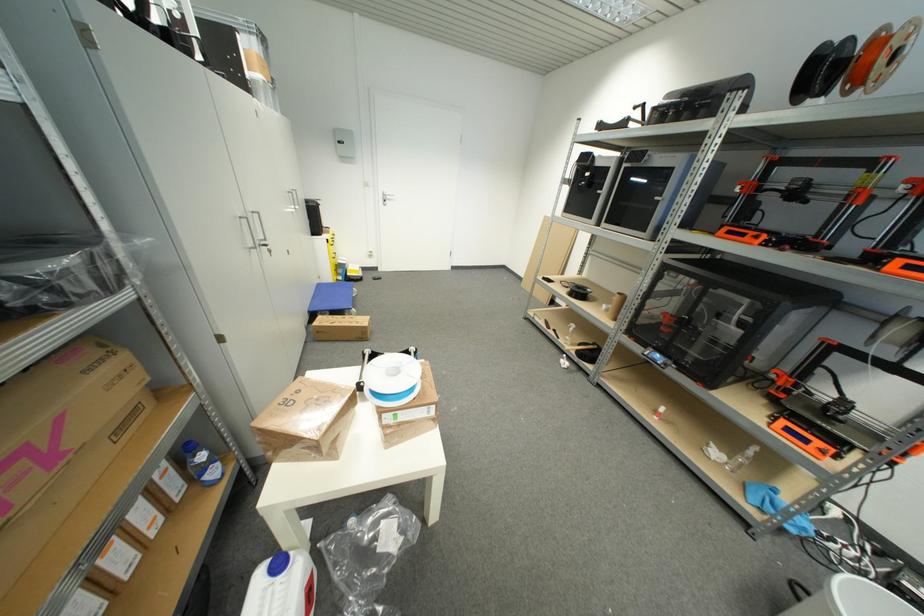
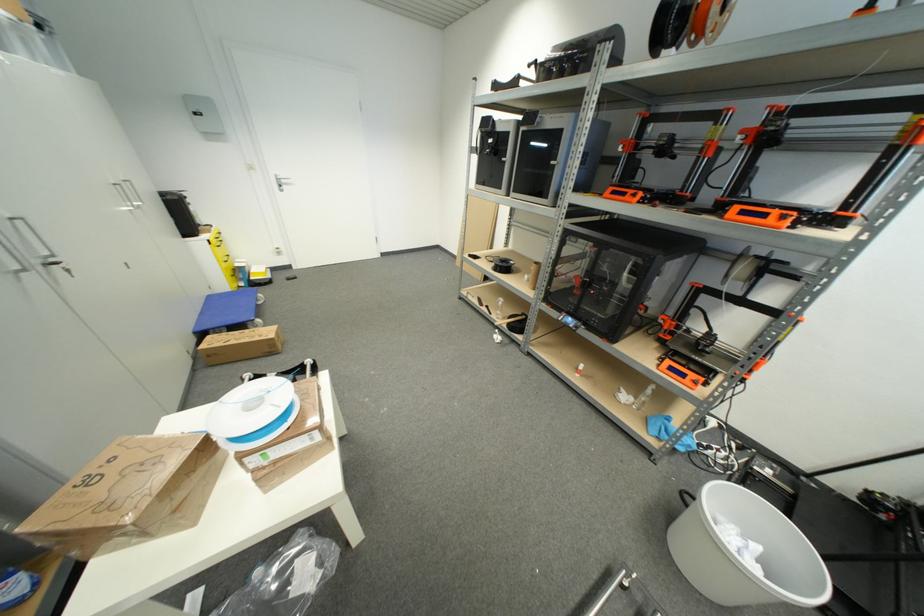
Locate, in the second image, the point that corresponds to (x=728, y=460) in the first image.

(636, 400)